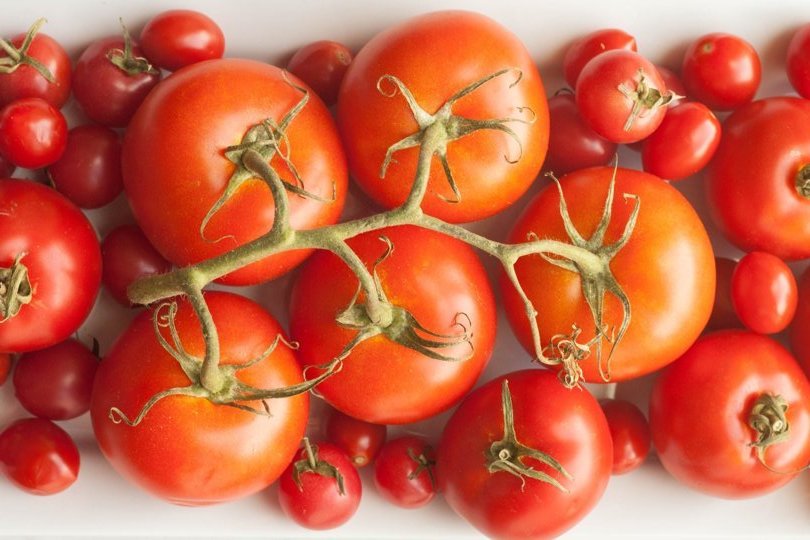
The image size is (810, 540). Identify the location of white table. click(126, 518), click(659, 494), click(538, 17), click(303, 17).